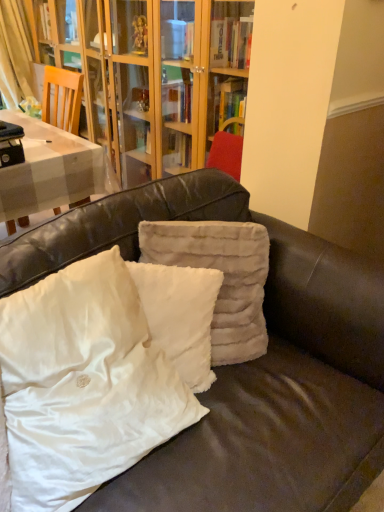
Question: Which direction should I rotate to face white fluffy pillow at center, which ranks as the 2th pillow in left-to-right order, — up or down?

Choices:
 (A) down
 (B) up

Answer: (A)

Question: From the image's perspective, is fuzzy beige pillow at center, which ranks as the first pillow in right-to-left order, under white fluffy pillow at center, positioned as the third pillow in right-to-left order?

Choices:
 (A) yes
 (B) no

Answer: (B)

Question: Is the position of fuzzy beige pillow at center, which is counted as the 3th pillow, starting from the left, less distant than that of white fluffy pillow at center, positioned as the third pillow in right-to-left order?

Choices:
 (A) yes
 (B) no

Answer: (B)

Question: Is fuzzy beige pillow at center, which ranks as the first pillow in right-to-left order, bigger than white fluffy pillow at center, the first pillow in the left-to-right sequence?

Choices:
 (A) no
 (B) yes

Answer: (A)

Question: Is fuzzy beige pillow at center, which ranks as the first pillow in right-to-left order, taller than white fluffy pillow at center, positioned as the third pillow in right-to-left order?

Choices:
 (A) no
 (B) yes

Answer: (A)

Question: Is fuzzy beige pillow at center, which ranks as the first pillow in right-to-left order, facing away from white fluffy pillow at center, the first pillow in the left-to-right sequence?

Choices:
 (A) yes
 (B) no

Answer: (B)

Question: From the image's perspective, is white fluffy pillow at center, marked as the 2th pillow in a right-to-left arrangement, on top of white fluffy pillow at center, the first pillow in the left-to-right sequence?

Choices:
 (A) no
 (B) yes

Answer: (B)

Question: Does white fluffy pillow at center, marked as the 2th pillow in a right-to-left arrangement, appear on the right side of white fluffy pillow at center, the first pillow in the left-to-right sequence?

Choices:
 (A) yes
 (B) no

Answer: (A)

Question: Does white fluffy pillow at center, which ranks as the 2th pillow in left-to-right order, have a greater width compared to white fluffy pillow at center, the first pillow in the left-to-right sequence?

Choices:
 (A) yes
 (B) no

Answer: (B)

Question: Is white fluffy pillow at center, marked as the 2th pillow in a right-to-left arrangement, smaller than white fluffy pillow at center, the first pillow in the left-to-right sequence?

Choices:
 (A) yes
 (B) no

Answer: (A)

Question: Is white fluffy pillow at center, marked as the 2th pillow in a right-to-left arrangement, positioned beyond the bounds of white fluffy pillow at center, positioned as the third pillow in right-to-left order?

Choices:
 (A) no
 (B) yes

Answer: (B)

Question: From a real-world perspective, is white fluffy pillow at center, marked as the 2th pillow in a right-to-left arrangement, under white fluffy pillow at center, the first pillow in the left-to-right sequence?

Choices:
 (A) no
 (B) yes

Answer: (B)

Question: Is fuzzy beige pillow at center, which ranks as the first pillow in right-to-left order, far away from white fluffy pillow at center, which ranks as the 2th pillow in left-to-right order?

Choices:
 (A) no
 (B) yes

Answer: (A)